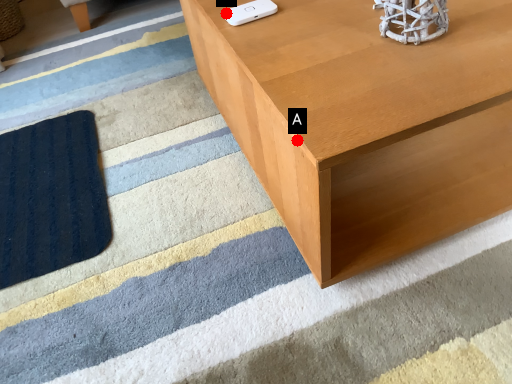
Question: Two points are circled on the image, labeled by A and B beside each circle. Which point is farther from the camera taking this photo?

Choices:
 (A) A is further
 (B) B is further

Answer: (B)